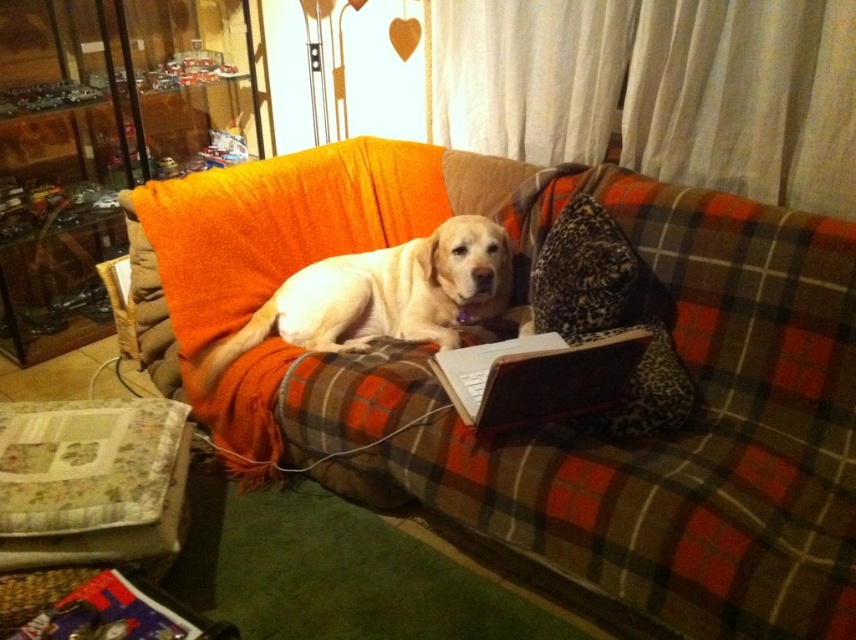
You are standing in front of the couch and want to place two items on specific points on the couch. The first item should be placed at point [354,316] and the second item at point [79,628]. Which point is closer to you when you are facing the couch?

Point [354,316] is further to the camera than point [79,628], so the point closer to you when facing the couch is point [79,628].

You are trying to reach for your metallic silver book at lower left but there is a silver metallic laptop at center in the way. Can you move the laptop to access the book?

The silver metallic laptop at center is above the metallic silver book at lower left, so you can move the laptop downward to access the book.

You are trying to place a silver metallic laptop at center on the couch. The leopard print pillow at center is already there. Will the laptop fit on the couch if the pillow is moved?

The leopard print pillow at center is thinner than the silver metallic laptop at center. Moving the pillow might free up enough space for the laptop, but since the pillow is thinner, it occupies less space. However, without knowing the exact dimensions of the couch and the laptop, it is uncertain if there will be enough space. Consider checking the available space before moving the pillow.